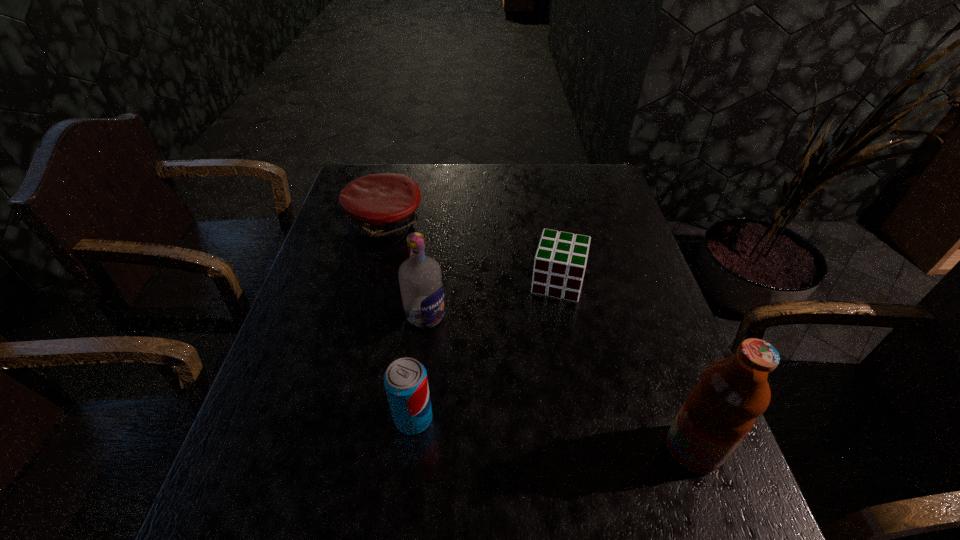
Where is `the third tallest object`? the third tallest object is located at coordinates (405, 380).

Where is `the rightmost object`? The width and height of the screenshot is (960, 540). the rightmost object is located at coordinates (721, 409).

Where is `the tallest object`? The width and height of the screenshot is (960, 540). the tallest object is located at coordinates (721, 409).

The width and height of the screenshot is (960, 540). In order to click on the farthest object in this screenshot , I will do `click(380, 207)`.

The image size is (960, 540). Identify the location of the fourth shortest object. (420, 279).

Locate an element on the screen. The image size is (960, 540). the fourth object from left to right is located at coordinates (560, 261).

I want to click on free region located on the front of the third tallest object, so click(x=406, y=478).

Identify the location of vacant space located 0.230m on the front label of the fruit juice. (546, 449).

Locate an element on the screen. This screenshot has height=540, width=960. free space located 0.180m on the front label of the fruit juice is located at coordinates (572, 449).

Locate an element on the screen. Image resolution: width=960 pixels, height=540 pixels. free space located 0.100m on the front label of the fruit juice is located at coordinates (613, 449).